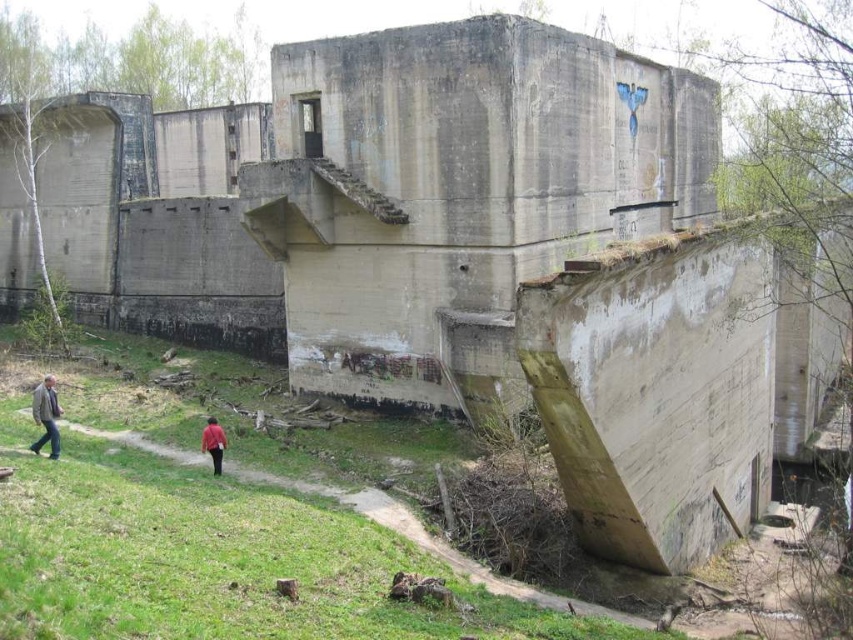
Which is above, light brown leather jacket at lower left or red matte shirt at lower center?

light brown leather jacket at lower left

This screenshot has width=853, height=640. Identify the location of light brown leather jacket at lower left. (45, 416).